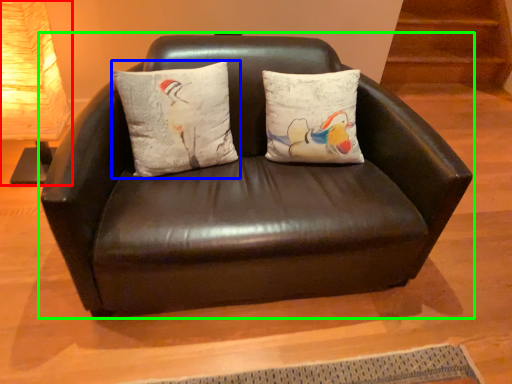
Question: Which is farther away from table lamp (highlighted by a red box)? pillow (highlighted by a blue box) or studio couch (highlighted by a green box)?

Choices:
 (A) pillow
 (B) studio couch

Answer: (B)